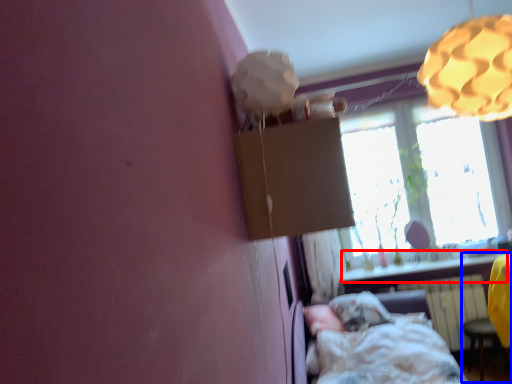
Question: Among these objects, which one is farthest to the camera, window sill (highlighted by a red box) or swivel chair (highlighted by a blue box)?

Choices:
 (A) window sill
 (B) swivel chair

Answer: (A)